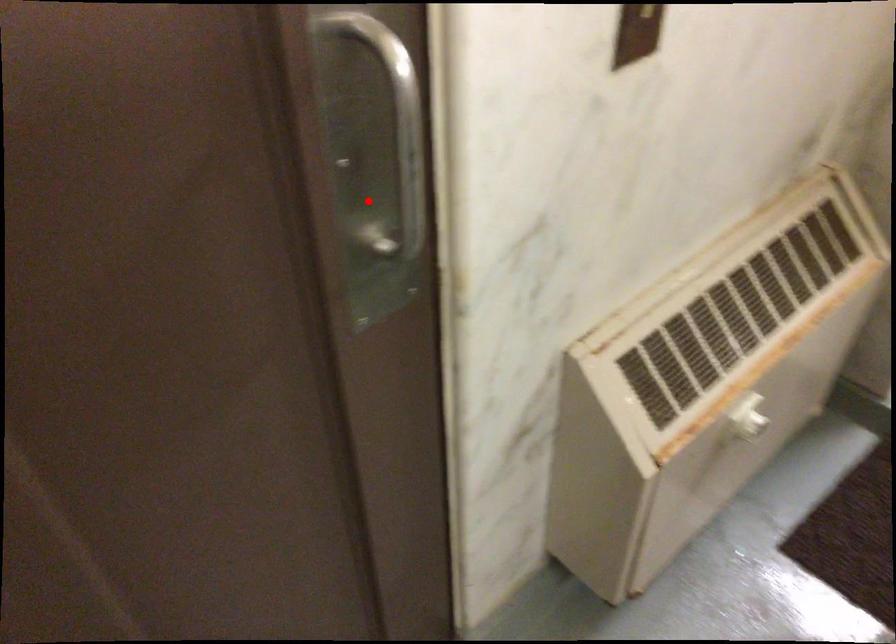
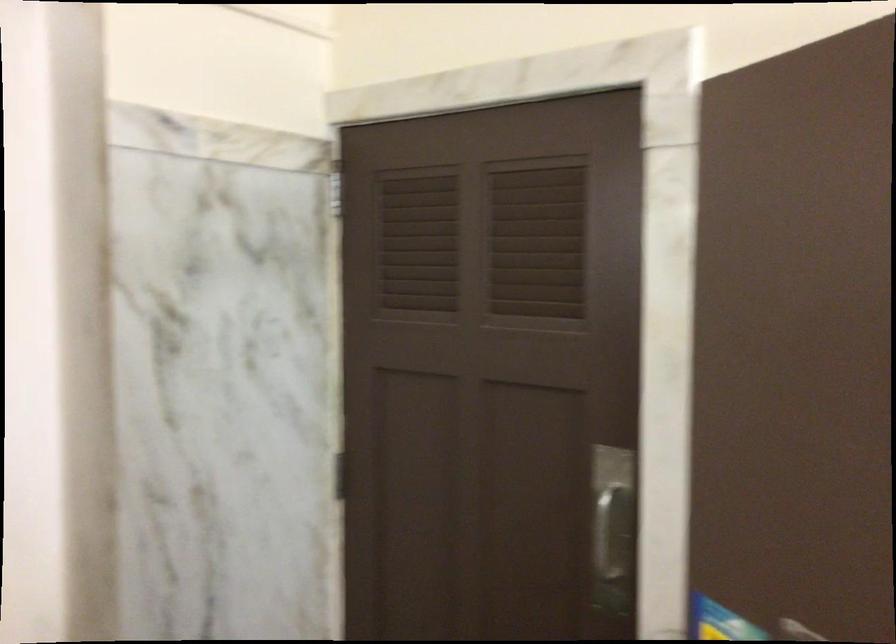
Question: A red point is marked in image1. In image2, is the corresponding 3D point closer to the camera or farther? Reply with the corresponding letter.

Choices:
 (A) The corresponding 3D point is closer.
 (B) The corresponding 3D point is farther.

Answer: (B)